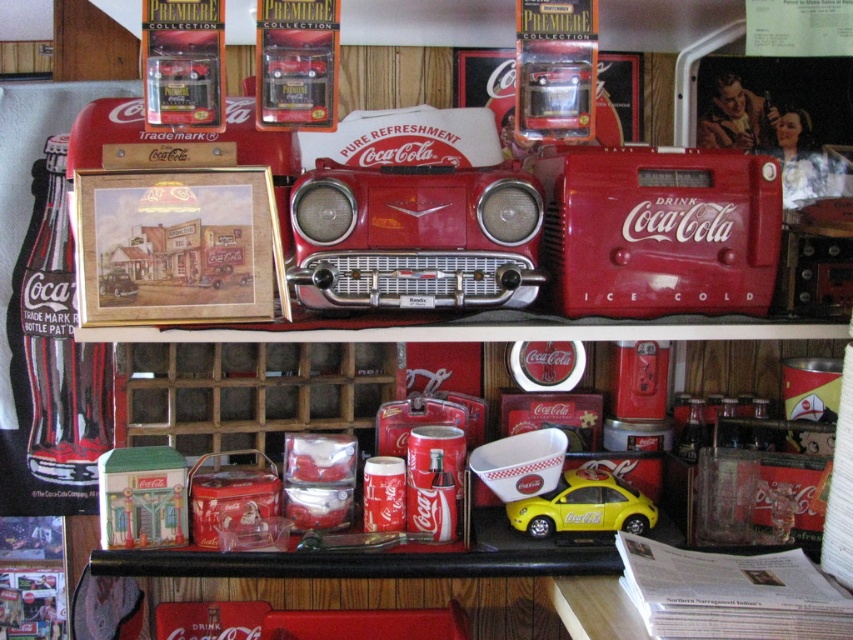
You are a collector who wants to place a new 1.5 feet wide Coca Cola poster between the metallic red car at center and the vintage red car shaped cooler on the top shelf. Is there enough space between them to fit the poster?

The metallic red car at center and the vintage red car shaped cooler on the top shelf are 3.42 feet apart. Since the poster is 1.5 feet wide, there is sufficient space between them to fit the poster as 3.42 feet is greater than 1.5 feet.